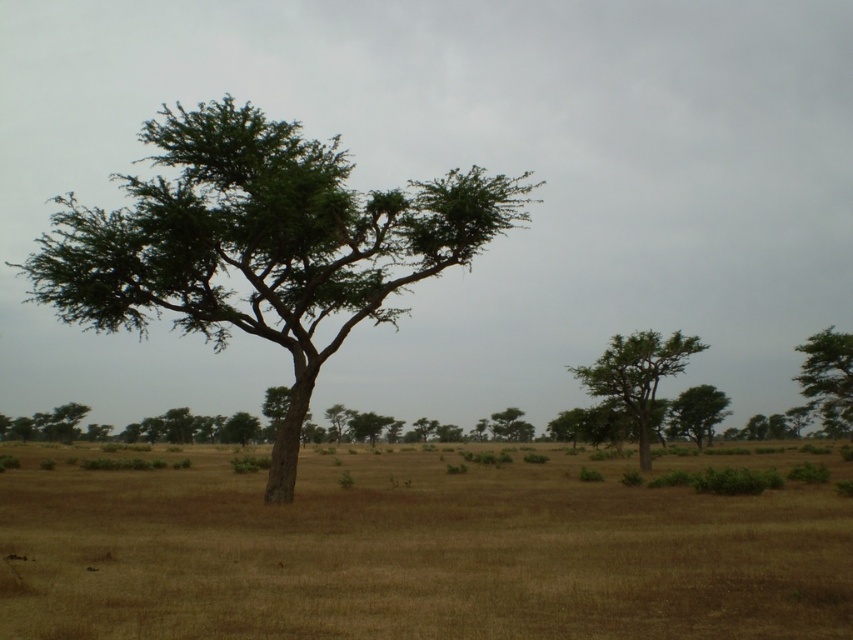
In the savanna scene, there are two trees at the right side of the image. The first is labeled as the green rough bark tree at right, and the second is the green leafy tree at right. From the perspective of someone standing in the center of the savanna looking towards the right, which tree is positioned closer to the left?

The green rough bark tree at right is positioned to the left of the green leafy tree at right, so when standing in the center looking towards the right, the green rough bark tree at right would be closer to the left side compared to the green leafy tree at right.